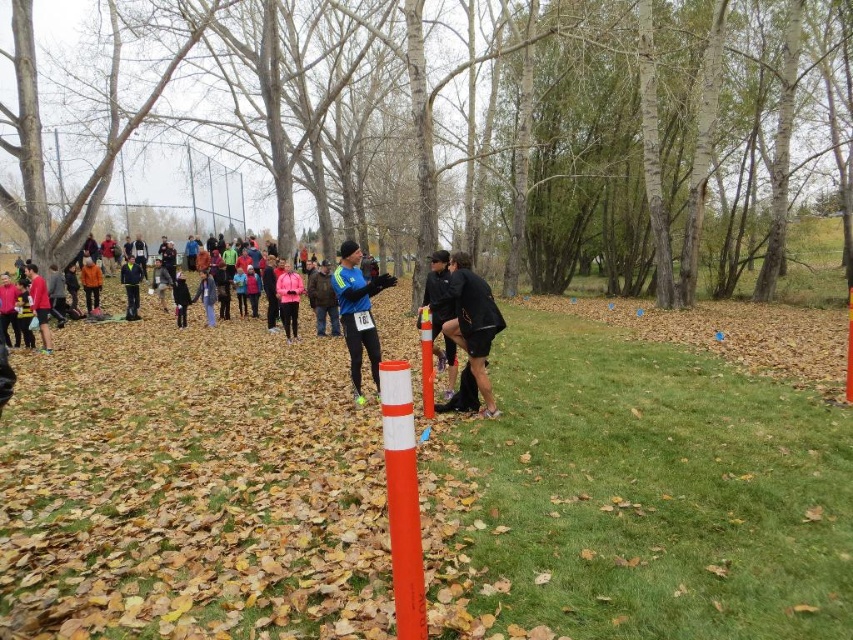
You are a photographer positioned at the starting line of the cross country race. You need to capture a photo that includes both the black matte shorts at center and the matte pink jacket at center. Based on their positions, which one should you focus on first to ensure both are in the frame?

The black matte shorts at center is located below the matte pink jacket at center, so you should focus on the matte pink jacket at center first to ensure both are in the frame.

You are a photographer at the cross country event and need to capture a photo of both the black matte shorts at center and the blue synthetic jacket at center. Which object should you focus on first if you want to ensure both are in the frame without moving the camera?

You should focus on the black matte shorts at center first since it is larger than the blue synthetic jacket at center, ensuring it fits within the frame before adjusting for the smaller object.

You are a runner participating in the cross country race. You see the orange matte pole at center and the black matte shorts at center. Which object is closer to you?

The orange matte pole at center has a smaller size compared to black matte shorts at center, so the orange matte pole at center is closer to you.